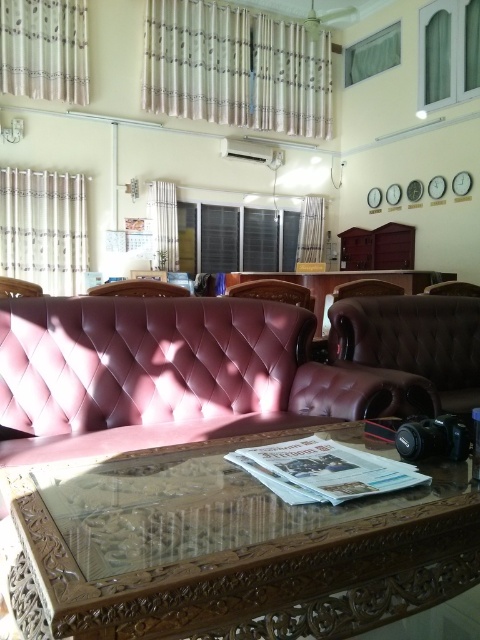
Which is in front, point (463, 285) or point (9, 292)?

Point (9, 292) is in front.

Which is above, brown leather chair at right or leather couch at left?

Positioned higher is brown leather chair at right.

Does point (471, 289) lie in front of point (11, 291)?

No, (471, 289) is behind (11, 291).

Find the location of `brown leather chair at right`. brown leather chair at right is located at coordinates (453, 289).

Who is lower down, white sheer curtain at left or brown leather chair at right?

brown leather chair at right

Does white sheer curtain at left appear on the right side of brown leather chair at right?

No, white sheer curtain at left is not to the right of brown leather chair at right.

Identify the location of white sheer curtain at left. The image size is (480, 640). (44, 228).

Is white sheer curtain at upper center bigger than white sheer curtain at center?

Indeed, white sheer curtain at upper center has a larger size compared to white sheer curtain at center.

Does white sheer curtain at upper center have a lesser width compared to white sheer curtain at center?

Yes.

The width and height of the screenshot is (480, 640). I want to click on white sheer curtain at upper center, so coord(164,225).

Where is `white sheer curtain at upper center`? This screenshot has width=480, height=640. white sheer curtain at upper center is located at coordinates (164, 225).